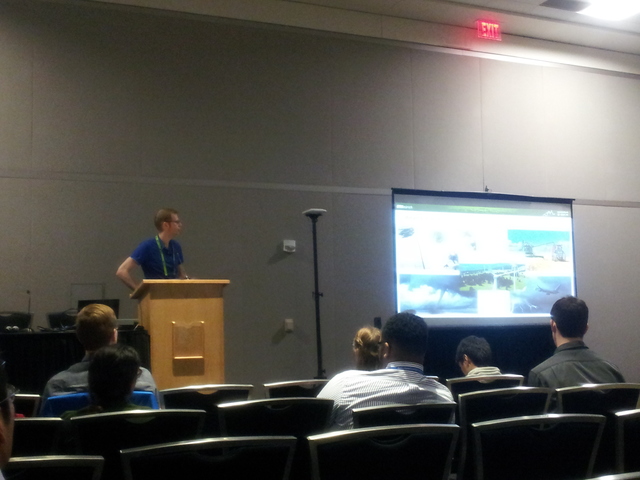
Locate an element on the screen. speaker is located at coordinates (170, 260).